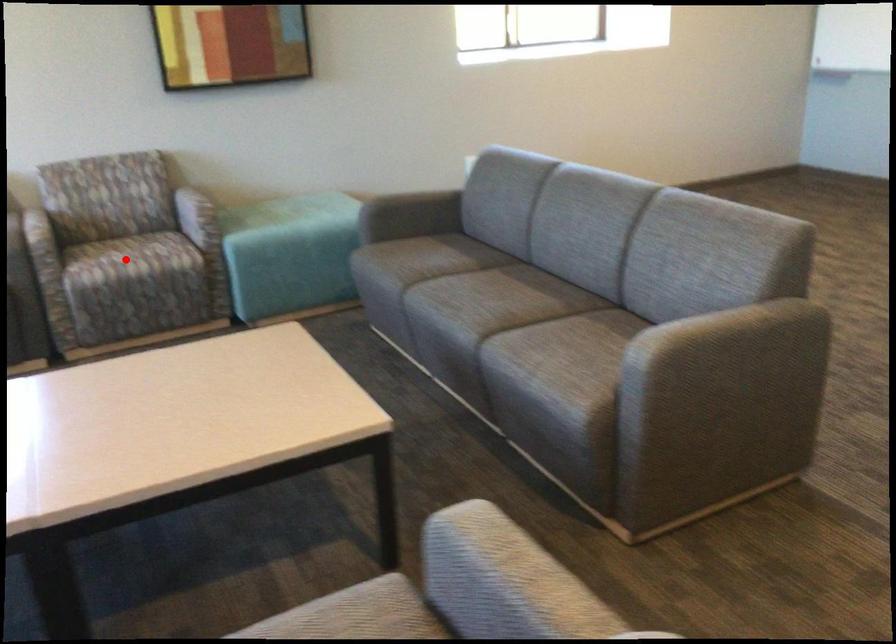
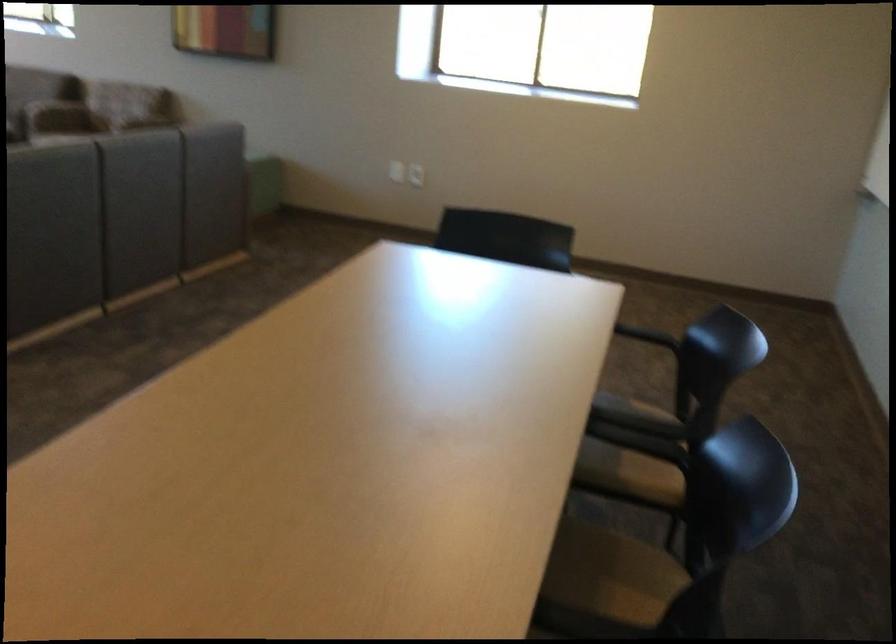
Question: I am providing you with two images of the same scene from different viewpoints. A red point is marked on the first image. Is the red point's position out of view in image 2?

Choices:
 (A) Yes
 (B) No

Answer: (A)